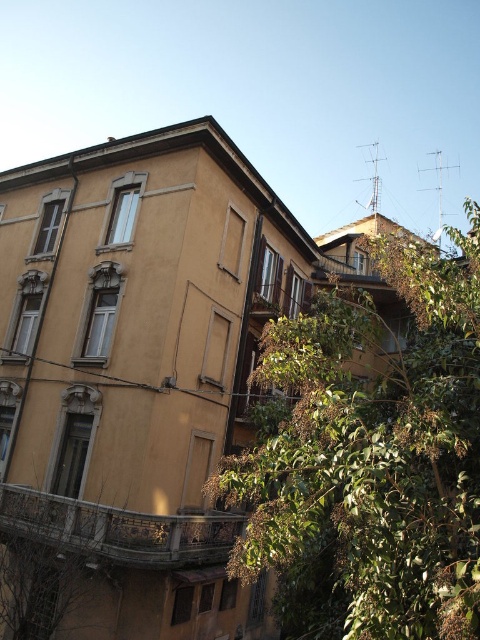
You are a delivery drone carrying a package that requires a landing zone at least 15 feet wide. You need to land between the green leafy tree at center and the stone textured balcony at lower left. Can you safely land there?

The distance between the green leafy tree at center and the stone textured balcony at lower left is 14.48 feet, which is less than the required 15 feet. Therefore, the drone cannot safely land there.

You are standing in front of the residential building and want to determine if the green leafy tree at center can block the view of the stone textured balcony at lower left. Based on their heights, what can you conclude?

The green leafy tree at center is taller than the stone textured balcony at lower left, so it can potentially block the view of the stone textured balcony at lower left depending on their positions.